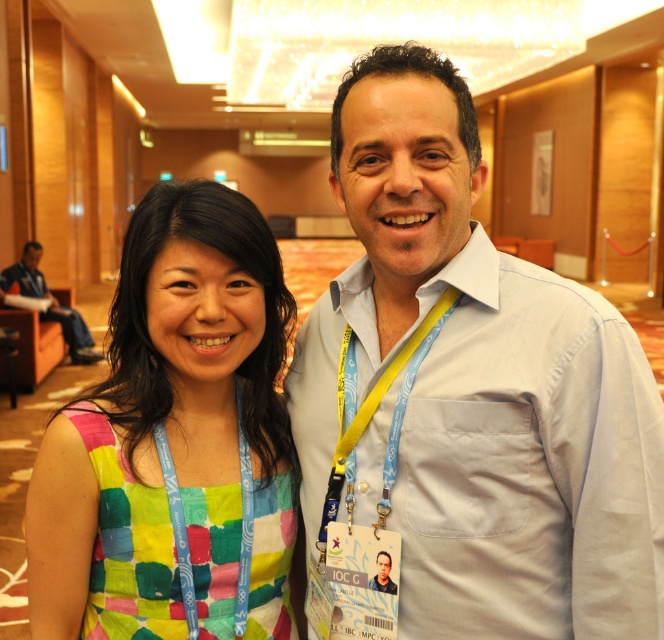
Is patchwork fabric dress at center thinner than matte fabric neck at center?

In fact, patchwork fabric dress at center might be wider than matte fabric neck at center.

This screenshot has width=664, height=640. What do you see at coordinates (173, 440) in the screenshot?
I see `patchwork fabric dress at center` at bounding box center [173, 440].

Is point (125, 416) positioned before point (183, 408)?

Yes, it is.

Where is `patchwork fabric dress at center`? This screenshot has width=664, height=640. patchwork fabric dress at center is located at coordinates (173, 440).

The height and width of the screenshot is (640, 664). Find the location of `patchwork fabric dress at center`. patchwork fabric dress at center is located at coordinates (173, 440).

Which of these two, patchwork fabric dress at center or blue fabric lanyard at center, stands shorter?

With less height is blue fabric lanyard at center.

Who is more forward, (208, 515) or (167, 472)?

Point (167, 472)

The width and height of the screenshot is (664, 640). What are the coordinates of `patchwork fabric dress at center` in the screenshot? It's located at (173, 440).

Does patchwork fabric dress at center appear on the left side of yellow fabric lanyard at center?

Correct, you'll find patchwork fabric dress at center to the left of yellow fabric lanyard at center.

Between patchwork fabric dress at center and yellow fabric lanyard at center, which one has less height?

With less height is yellow fabric lanyard at center.

You are a GUI agent. You are given a task and a screenshot of the screen. Output one action in this format:
    pyautogui.click(x=<x>, y=<y>)
    Task: Click on the patchwork fabric dress at center
    This screenshot has width=664, height=640.
    Given the screenshot: What is the action you would take?
    pyautogui.click(x=173, y=440)

At what (x,y) coordinates should I click in order to perform the action: click on patchwork fabric dress at center. Please return your answer as a coordinate pair (x, y). Image resolution: width=664 pixels, height=640 pixels. Looking at the image, I should click on (173, 440).